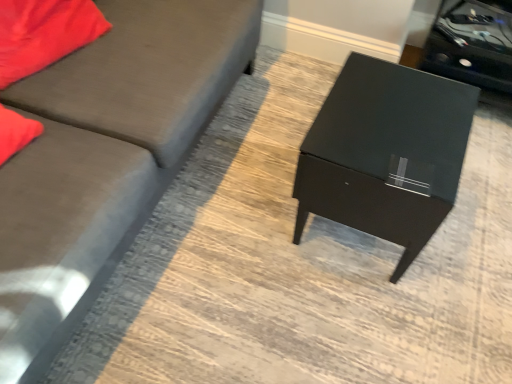
Measure the distance between matte black table at center and camera.

3.36 feet.

Where is `matte black table at center`? This screenshot has width=512, height=384. matte black table at center is located at coordinates (x=385, y=153).

Identify the location of matte red pillow at upper left. The width and height of the screenshot is (512, 384). (44, 33).

Find the location of a particular element. This screenshot has width=512, height=384. matte gray couch at left is located at coordinates (104, 155).

Considering the relative sizes of black glossy side table at upper right and matte black table at center in the image provided, is black glossy side table at upper right taller than matte black table at center?

No, black glossy side table at upper right is not taller than matte black table at center.

Identify the location of table above the black glossy side table at upper right (from a real-world perspective). The width and height of the screenshot is (512, 384). (385, 153).

Considering the sizes of objects black glossy side table at upper right and matte black table at center in the image provided, who is wider, black glossy side table at upper right or matte black table at center?

Wider between the two is matte black table at center.

Is black glossy side table at upper right looking in the opposite direction of matte black table at center?

No, black glossy side table at upper right is not facing away from matte black table at center.

Does matte gray couch at left turn towards matte black table at center?

Yes, matte gray couch at left is turned towards matte black table at center.

Is matte gray couch at left completely or partially outside of matte black table at center?

That's correct, matte gray couch at left is outside of matte black table at center.

Is matte gray couch at left thinner than matte black table at center?

No, matte gray couch at left is not thinner than matte black table at center.

From a real-world perspective, who is located higher, matte gray couch at left or matte black table at center?

In real-world perspective, matte gray couch at left is above.

Is matte black table at center in front of or behind matte red pillow at upper left in the image?

Visually, matte black table at center is located in front of matte red pillow at upper left.

In the scene shown: Who is taller, matte black table at center or matte red pillow at upper left?

Standing taller between the two is matte black table at center.

From the image's perspective, would you say matte gray couch at left is positioned over matte red pillow at upper left?

Actually, matte gray couch at left appears below matte red pillow at upper left in the image.

Can you tell me how much matte gray couch at left and matte red pillow at upper left differ in facing direction?

13.7 degrees separate the facing orientations of matte gray couch at left and matte red pillow at upper left.

In terms of width, does matte gray couch at left look wider or thinner when compared to matte red pillow at upper left?

Considering their sizes, matte gray couch at left looks broader than matte red pillow at upper left.

Could you tell me if matte gray couch at left is turned towards matte red pillow at upper left?

Yes, matte gray couch at left is facing matte red pillow at upper left.

Consider the image. Is matte black table at center looking in the opposite direction of black glossy side table at upper right?

Yes, black glossy side table at upper right is at the back of matte black table at center.

Considering the relative positions of matte black table at center and black glossy side table at upper right in the image provided, is matte black table at center to the left of black glossy side table at upper right from the viewer's perspective?

Result: Yes.

Identify the location of side table on the right of the matte black table at center. The width and height of the screenshot is (512, 384). (472, 43).

Is black glossy side table at upper right bigger than matte red pillow at upper left?

Yes.

Identify the location of side table that is on the right side of matte red pillow at upper left. (472, 43).

In the image, is black glossy side table at upper right positioned in front of or behind matte red pillow at upper left?

Clearly, black glossy side table at upper right is behind matte red pillow at upper left.

This screenshot has height=384, width=512. Find the location of `studio couch in front of the black glossy side table at upper right`. studio couch in front of the black glossy side table at upper right is located at coordinates (104, 155).

Does point (207, 72) lie behind point (507, 49)?

No, it is in front of (507, 49).

Looking at their sizes, would you say matte gray couch at left is wider or thinner than black glossy side table at upper right?

matte gray couch at left is wider than black glossy side table at upper right.

The width and height of the screenshot is (512, 384). In order to click on side table located above the matte black table at center (from the image's perspective) in this screenshot , I will do `click(472, 43)`.

Identify the location of studio couch in front of the matte black table at center. This screenshot has width=512, height=384. (104, 155).

Looking at the image, which one is located further to black glossy side table at upper right, matte black table at center or matte gray couch at left?

matte gray couch at left is further to black glossy side table at upper right.

Which object lies further to the anchor point black glossy side table at upper right, matte red pillow at upper left or matte gray couch at left?

matte red pillow at upper left.

Based on their spatial positions, is matte red pillow at upper left or black glossy side table at upper right closer to matte gray couch at left?

matte red pillow at upper left is closer to matte gray couch at left.

Based on their spatial positions, is matte black table at center or matte red pillow at upper left closer to black glossy side table at upper right?

matte black table at center is closer to black glossy side table at upper right.

Estimate the real-world distances between objects in this image. Which object is closer to matte black table at center, matte gray couch at left or matte red pillow at upper left?

Based on the image, matte gray couch at left appears to be nearer to matte black table at center.

Consider the image. Considering their positions, is matte gray couch at left positioned closer to matte red pillow at upper left than matte black table at center?

matte gray couch at left is closer to matte red pillow at upper left.

Based on their spatial positions, is matte red pillow at upper left or black glossy side table at upper right further from matte black table at center?

matte red pillow at upper left is positioned further to the anchor matte black table at center.

In the scene shown: Based on their spatial positions, is black glossy side table at upper right or matte black table at center further from matte gray couch at left?

black glossy side table at upper right is positioned further to the anchor matte gray couch at left.

Find the location of a particular element. Image resolution: width=512 pixels, height=384 pixels. table between matte red pillow at upper left and black glossy side table at upper right from left to right is located at coordinates (385, 153).

Where is `studio couch between matte red pillow at upper left and black glossy side table at upper right from left to right`? studio couch between matte red pillow at upper left and black glossy side table at upper right from left to right is located at coordinates (104, 155).

Locate an element on the screen. The image size is (512, 384). studio couch between matte red pillow at upper left and matte black table at center is located at coordinates (104, 155).

The height and width of the screenshot is (384, 512). I want to click on table between matte gray couch at left and black glossy side table at upper right from left to right, so click(x=385, y=153).